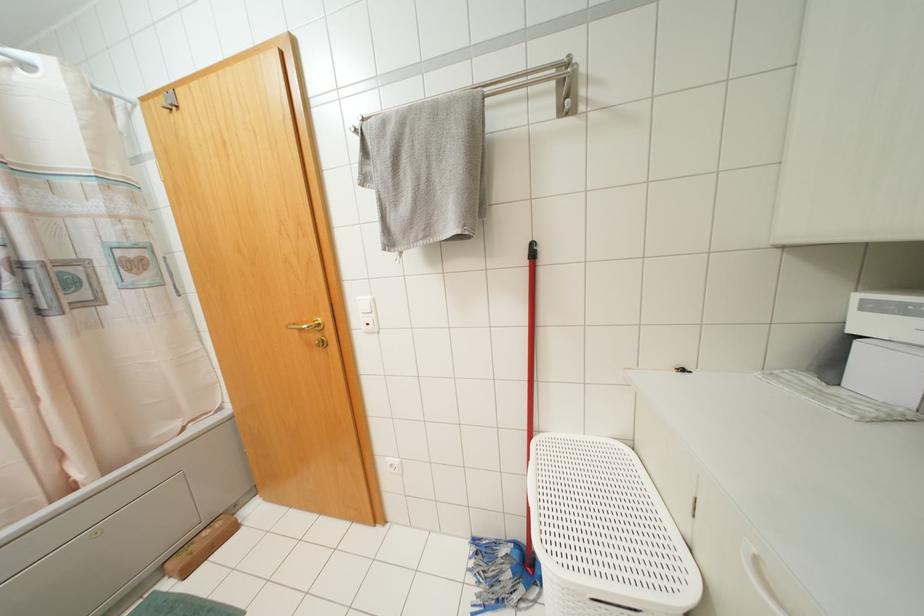
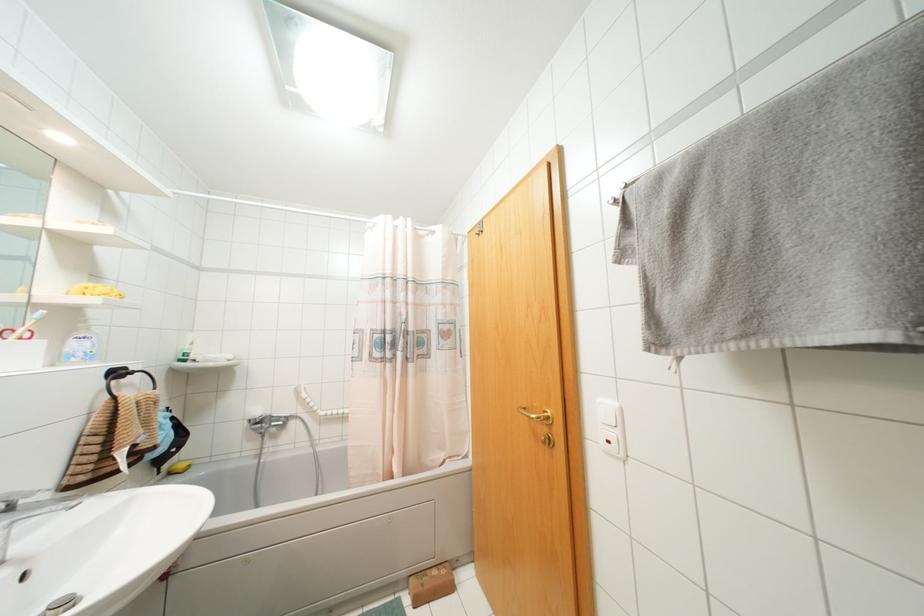
Question: I am providing you with two images of the same scene from different viewpoints. Please identify which objects are invisible in image2.

Choices:
 (A) soap dispenser pump
 (B) sink drain plug
 (C) white light switch
 (D) none of these

Answer: (D)